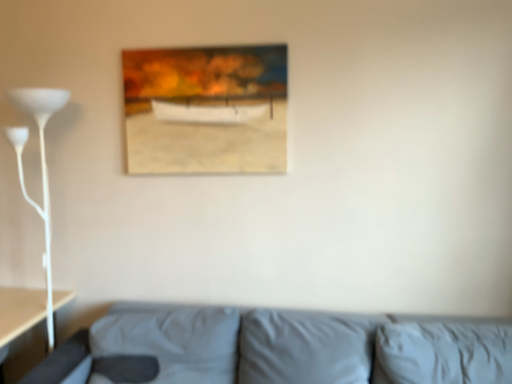
Question: Is gray fabric couch at lower center completely or partially outside of white glossy floor lamp at left?

Choices:
 (A) yes
 (B) no

Answer: (A)

Question: Considering the relative sizes of gray fabric couch at lower center and white glossy floor lamp at left in the image provided, is gray fabric couch at lower center thinner than white glossy floor lamp at left?

Choices:
 (A) no
 (B) yes

Answer: (A)

Question: From the image's perspective, would you say gray fabric couch at lower center is positioned over white glossy floor lamp at left?

Choices:
 (A) yes
 (B) no

Answer: (B)

Question: Is gray fabric couch at lower center far away from white glossy floor lamp at left?

Choices:
 (A) yes
 (B) no

Answer: (B)

Question: Is gray fabric couch at lower center further to the viewer compared to white glossy floor lamp at left?

Choices:
 (A) yes
 (B) no

Answer: (B)

Question: Can you confirm if gray fabric couch at lower center is bigger than white glossy floor lamp at left?

Choices:
 (A) no
 (B) yes

Answer: (B)

Question: Considering the relative positions of wooden frame at upper center and gray fabric couch at lower center in the image provided, is wooden frame at upper center to the right of gray fabric couch at lower center from the viewer's perspective?

Choices:
 (A) no
 (B) yes

Answer: (A)

Question: Considering the relative sizes of wooden frame at upper center and gray fabric couch at lower center in the image provided, is wooden frame at upper center bigger than gray fabric couch at lower center?

Choices:
 (A) no
 (B) yes

Answer: (A)

Question: Would you consider wooden frame at upper center to be distant from gray fabric couch at lower center?

Choices:
 (A) yes
 (B) no

Answer: (B)

Question: Is wooden frame at upper center thinner than gray fabric couch at lower center?

Choices:
 (A) no
 (B) yes

Answer: (B)

Question: Does wooden frame at upper center have a smaller size compared to gray fabric couch at lower center?

Choices:
 (A) no
 (B) yes

Answer: (B)

Question: Considering the relative sizes of wooden frame at upper center and gray fabric couch at lower center in the image provided, is wooden frame at upper center wider than gray fabric couch at lower center?

Choices:
 (A) no
 (B) yes

Answer: (A)

Question: Can you confirm if wooden frame at upper center is smaller than white glossy floor lamp at left?

Choices:
 (A) no
 (B) yes

Answer: (B)